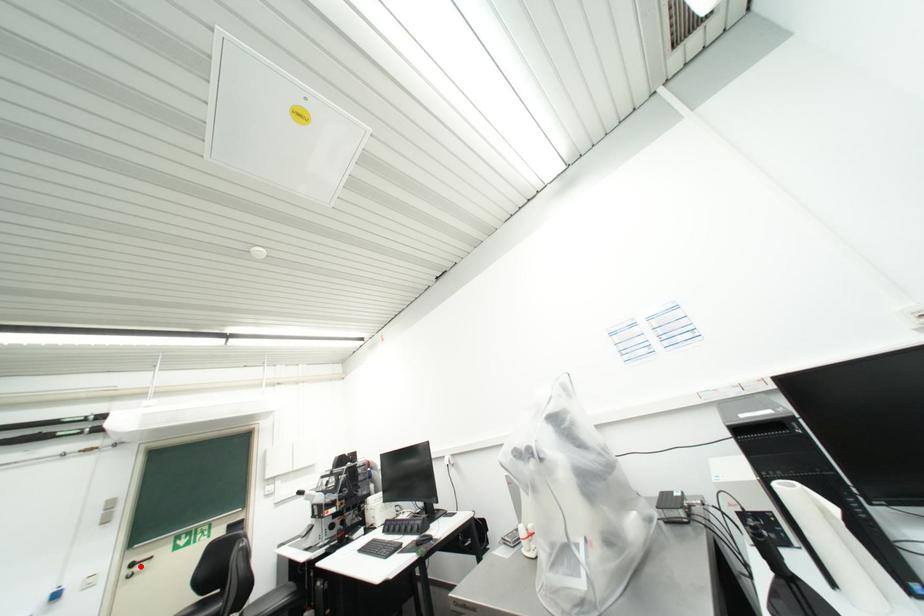
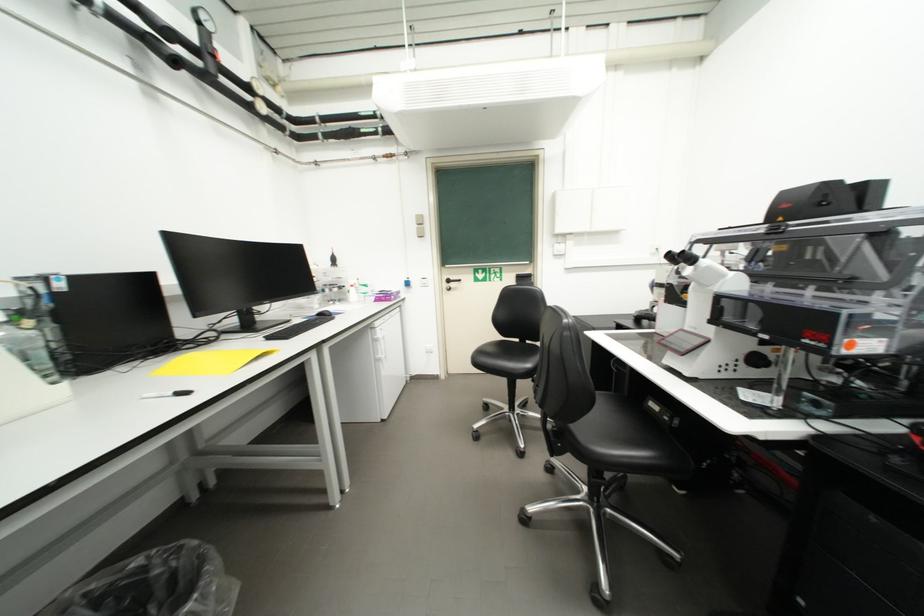
The point at the highlighted location is marked in the first image. Where is the corresponding point in the second image?

(456, 283)